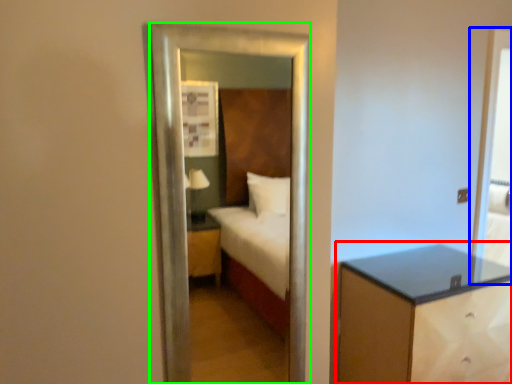
Question: Based on their relative distances, which object is nearer to nightstand (highlighted by a red box)? Choose from screen door (highlighted by a blue box) and mirror (highlighted by a green box).

Choices:
 (A) screen door
 (B) mirror

Answer: (A)